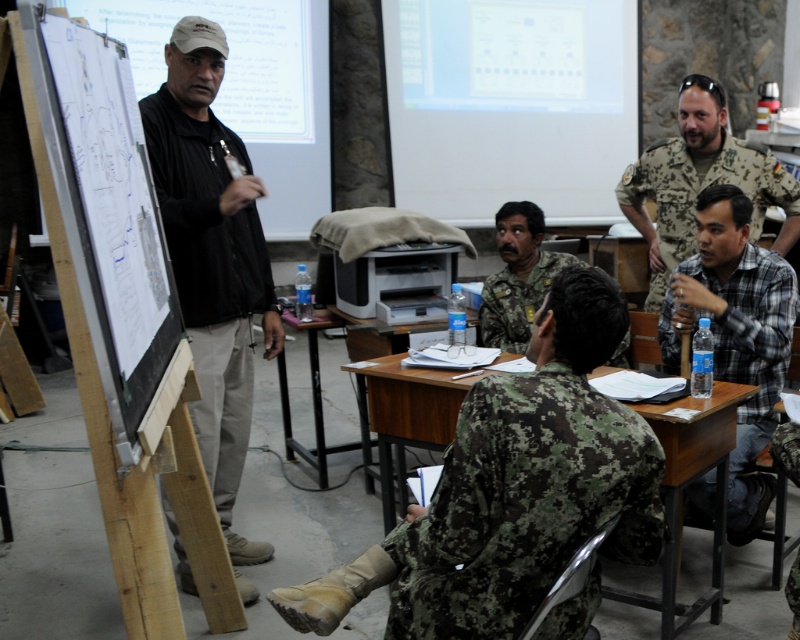
You are a photographer setting up for a group photo in the classroom. You need to position yourself so that both the black matte jacket at left and the camouflage uniform at center are fully visible in your frame. Based on their positions and sizes, which object should you prioritize keeping closer to the edge of the frame to ensure both are captured?

The black matte jacket at left is wider than the camouflage uniform at center, so you should prioritize keeping the black matte jacket at left closer to the edge of the frame to ensure both are fully visible.